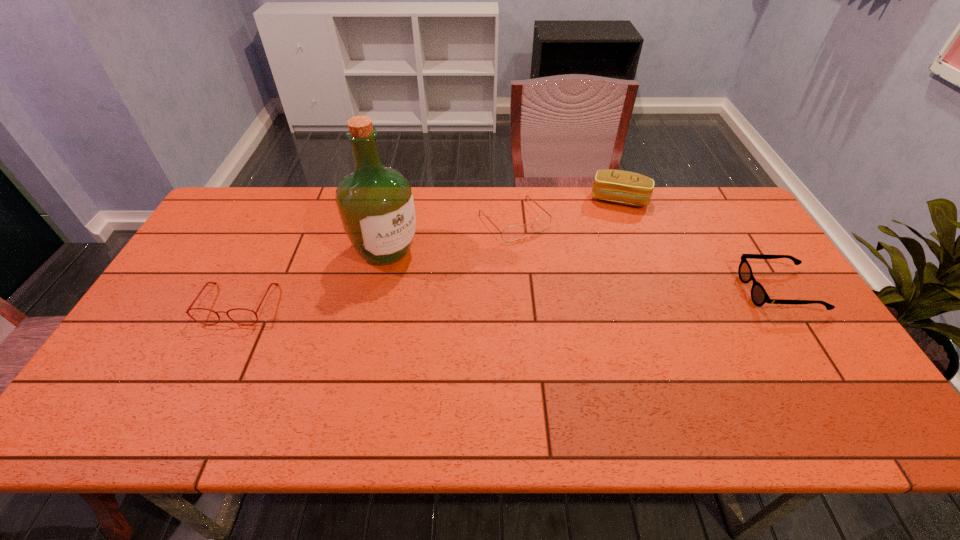
Image resolution: width=960 pixels, height=540 pixels. Find the location of `the leftmost object`. the leftmost object is located at coordinates (207, 283).

Find the location of `the rightmost spectacles`. the rightmost spectacles is located at coordinates (759, 296).

This screenshot has height=540, width=960. I want to click on the third object from left to right, so click(x=512, y=233).

Identify the location of the second spectacles from left to right. (512, 233).

Where is `the tallest object`? The image size is (960, 540). the tallest object is located at coordinates (375, 203).

This screenshot has width=960, height=540. I want to click on the second object from left to right, so click(375, 203).

Find the location of a particular element. The width and height of the screenshot is (960, 540). the fourth shortest object is located at coordinates (x=618, y=186).

Identify the location of the fourth object from left to right. (618, 186).

This screenshot has width=960, height=540. Find the location of `vacant space located 0.080m on the face of the leftmost object`. vacant space located 0.080m on the face of the leftmost object is located at coordinates (215, 351).

At what (x,y) coordinates should I click in order to perform the action: click on free region located 0.390m on the arms of the rightmost spectacles. Please return your answer as a coordinate pair (x, y). The image size is (960, 540). Looking at the image, I should click on pyautogui.click(x=608, y=291).